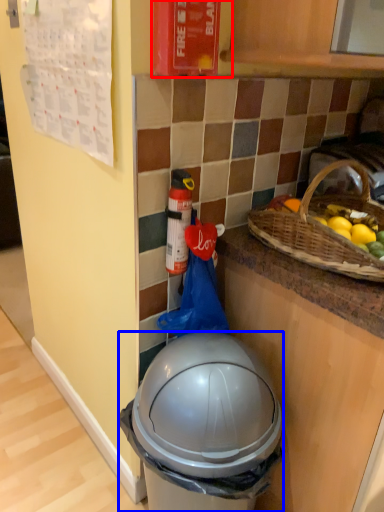
Question: Which object appears farthest to the camera in this image, fire extinguisher (highlighted by a red box) or trash bin/can (highlighted by a blue box)?

Choices:
 (A) fire extinguisher
 (B) trash bin/can

Answer: (A)